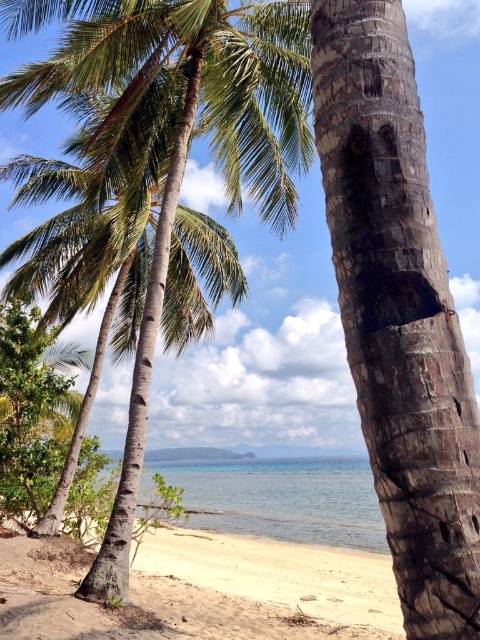
In the scene shown: You are standing at the beach and want to take a photo of the dark brown textured bark at center. If your camera can focus on objects up to 10 feet away, will you be able to capture a clear image of the bark?

The dark brown textured bark at center is 6.88 feet away from the camera, which is within the camera focus range of up to 10 feet. Therefore, you can capture a clear image of the bark.

You are standing on the tropical beach scene described. There are two points marked in the image. One is at coordinate point (403, 552) and the other at point (86, 45). Which point is nearer to you as you look at the scene?

Point (403, 552) is closer to the viewer than point (86, 45).

You are standing on the sandy beach at lower left and want to reach the clear blue water at center. Based on the scene description, which direction should you move to get closer to the water?

Since the sandy beach at lower left is much taller than the clear blue water at center, you should move downward towards the clear blue water at center to get closer.